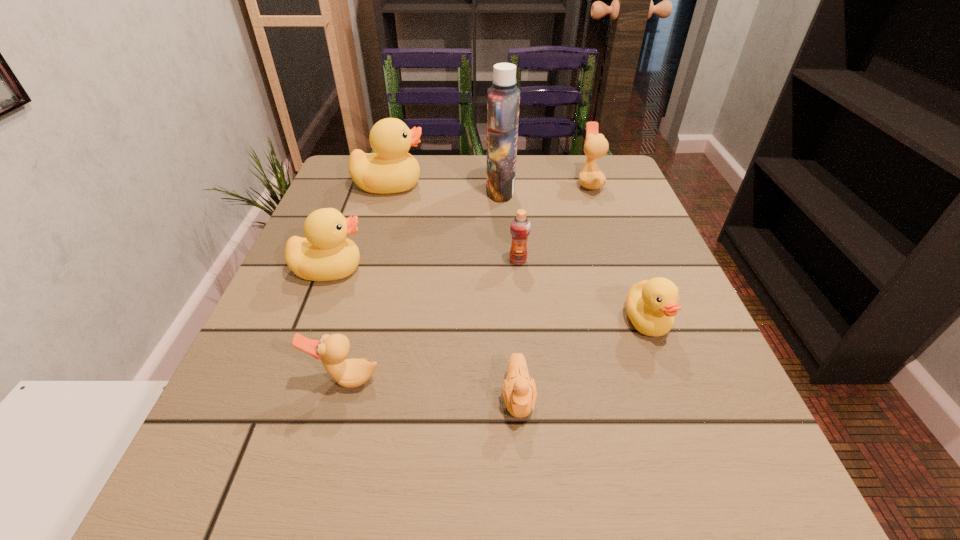
At what (x,y) coordinates should I click in order to perform the action: click on blue shampoo. Please return your answer as a coordinate pair (x, y). Looking at the image, I should click on (503, 98).

Image resolution: width=960 pixels, height=540 pixels. Identify the location of the tallest object. (503, 98).

The height and width of the screenshot is (540, 960). Find the location of `the farthest yellow duck`. the farthest yellow duck is located at coordinates (390, 169).

I want to click on the biggest yellow duck, so click(390, 169).

The width and height of the screenshot is (960, 540). I want to click on the second biggest yellow duck, so click(326, 254).

Identify the location of the third nearest duck. (326, 254).

The height and width of the screenshot is (540, 960). In order to click on the right tan duck in this screenshot , I will do 596,146.

Where is `the bigger tan duck`? This screenshot has height=540, width=960. the bigger tan duck is located at coordinates (596, 146).

You are a GUI agent. You are given a task and a screenshot of the screen. Output one action in this format:
    pyautogui.click(x=<x>, y=<y>)
    Task: Click on the orange juice
    This screenshot has height=540, width=960.
    Given the screenshot: What is the action you would take?
    pyautogui.click(x=520, y=226)

At what (x,y) coordinates should I click in order to perform the action: click on the rightmost yellow duck. Please return your answer as a coordinate pair (x, y). Image resolution: width=960 pixels, height=540 pixels. Looking at the image, I should click on (651, 305).